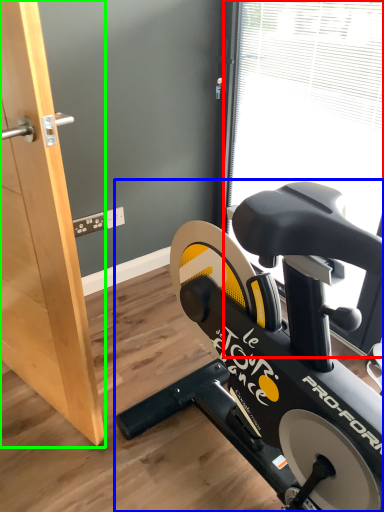
Question: Considering the real-world distances, which object is closest to window screen (highlighted by a red box)? stationary bicycle (highlighted by a blue box) or screen door (highlighted by a green box).

Choices:
 (A) stationary bicycle
 (B) screen door

Answer: (A)